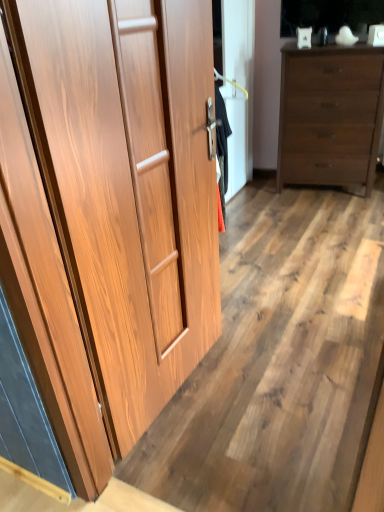
Question: Does wooden cupboard at left turn towards matte brown dresser at right?

Choices:
 (A) no
 (B) yes

Answer: (A)

Question: Is wooden cupboard at left shorter than matte brown dresser at right?

Choices:
 (A) yes
 (B) no

Answer: (B)

Question: Is wooden cupboard at left far away from matte brown dresser at right?

Choices:
 (A) no
 (B) yes

Answer: (B)

Question: Does wooden cupboard at left have a larger size compared to matte brown dresser at right?

Choices:
 (A) no
 (B) yes

Answer: (A)

Question: From the image's perspective, is wooden cupboard at left located above matte brown dresser at right?

Choices:
 (A) no
 (B) yes

Answer: (A)

Question: Does wooden cupboard at left have a greater height compared to matte brown dresser at right?

Choices:
 (A) no
 (B) yes

Answer: (B)

Question: Can you confirm if wooden floor at center is bigger than wooden cupboard at left?

Choices:
 (A) no
 (B) yes

Answer: (B)

Question: Is wooden floor at center positioned beyond the bounds of wooden cupboard at left?

Choices:
 (A) yes
 (B) no

Answer: (A)

Question: Can you confirm if wooden floor at center is shorter than wooden cupboard at left?

Choices:
 (A) yes
 (B) no

Answer: (A)

Question: Is wooden floor at center behind wooden cupboard at left?

Choices:
 (A) no
 (B) yes

Answer: (B)

Question: Does wooden floor at center have a smaller size compared to wooden cupboard at left?

Choices:
 (A) yes
 (B) no

Answer: (B)

Question: Are wooden floor at center and wooden cupboard at left making contact?

Choices:
 (A) no
 (B) yes

Answer: (A)

Question: Is the position of matte brown dresser at right more distant than that of wooden floor at center?

Choices:
 (A) no
 (B) yes

Answer: (B)